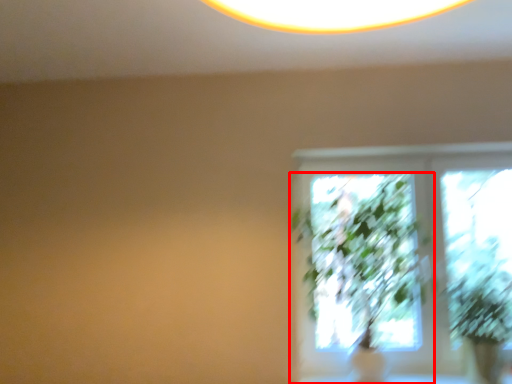
Question: Where is houseplant (annotated by the red box) located in relation to plant in the image?

Choices:
 (A) left
 (B) right

Answer: (A)